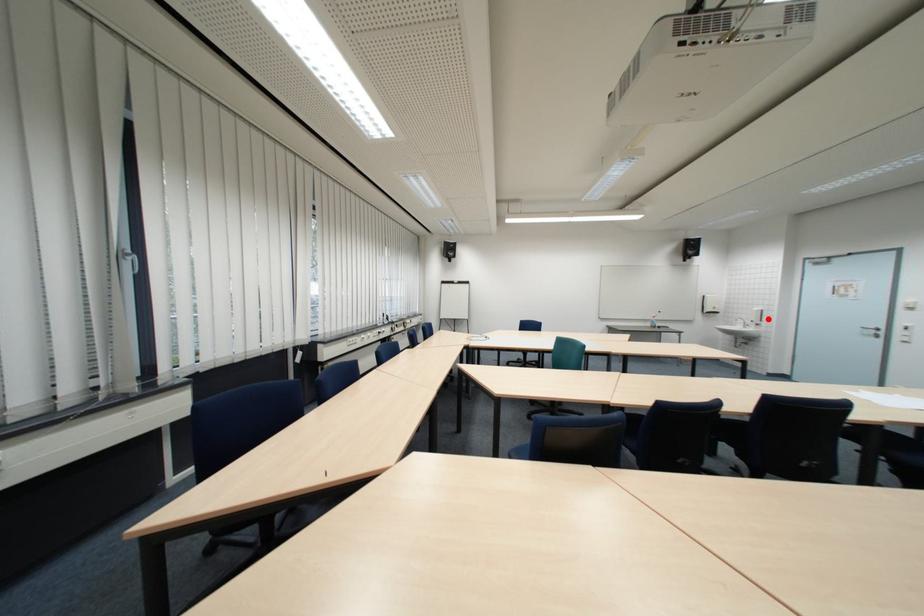
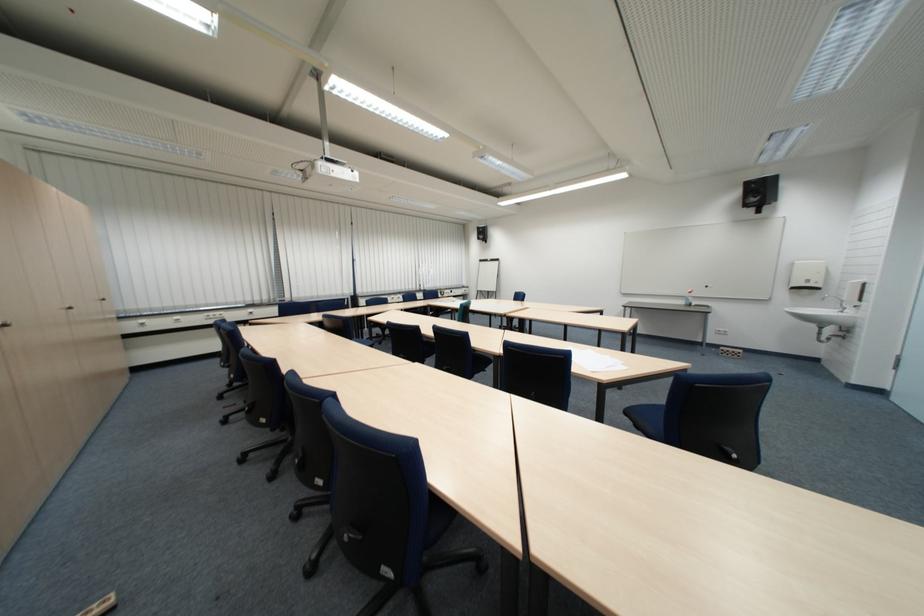
In the second image, find the point that corresponds to the highlighted location in the first image.

(860, 296)